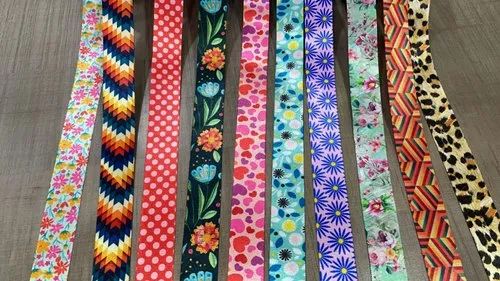
Where is `orange flowers`? This screenshot has height=281, width=500. orange flowers is located at coordinates (203, 238), (210, 141), (213, 59).